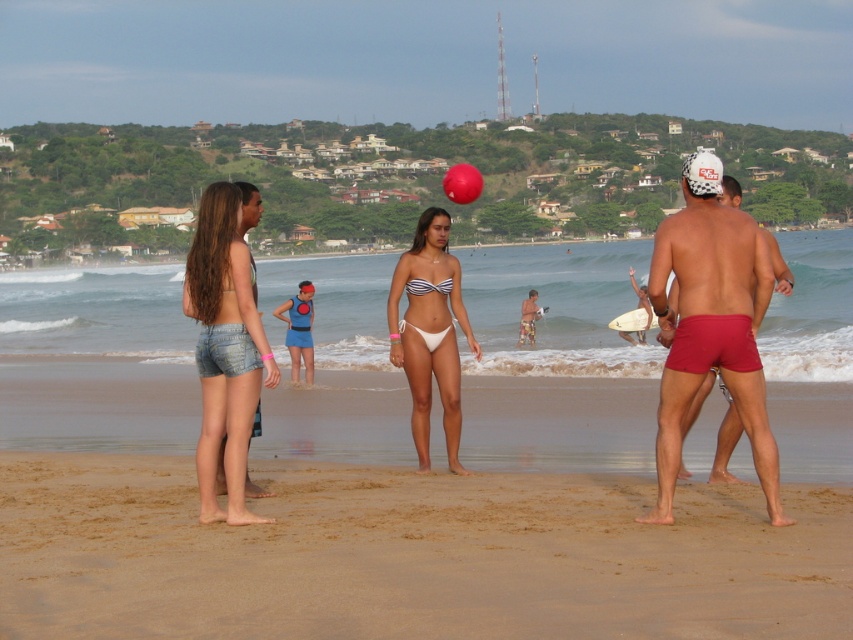
You are a photographer trying to capture a photo of the denim shorts at left and the white striped bikini at center. If you want to ensure both subjects are fully visible in the frame, which one should you focus on first to avoid cropping?

You should focus on the denim shorts at left first because it might be wider than the white striped bikini at center, so adjusting the frame to accommodate its width ensures both are fully visible.

You are a photographer trying to capture the perfect shot of the white matte bikini at center. Based on the scene description, where should you position your camera to ensure the bikini is centered in your frame?

The white matte bikini at center is located at point (430,332), which is very close to the center of the frame. Positioning the camera directly facing the center of the scene will ensure the bikini is centered in your frame.

In the beach scene described, there are a white matte bikini at center and a rubber volleyball at center. Which object is positioned to the right side from the observer?

The white matte bikini at center is to the right of the rubber volleyball at center, so the white matte bikini at center is positioned to the right side from the observer.